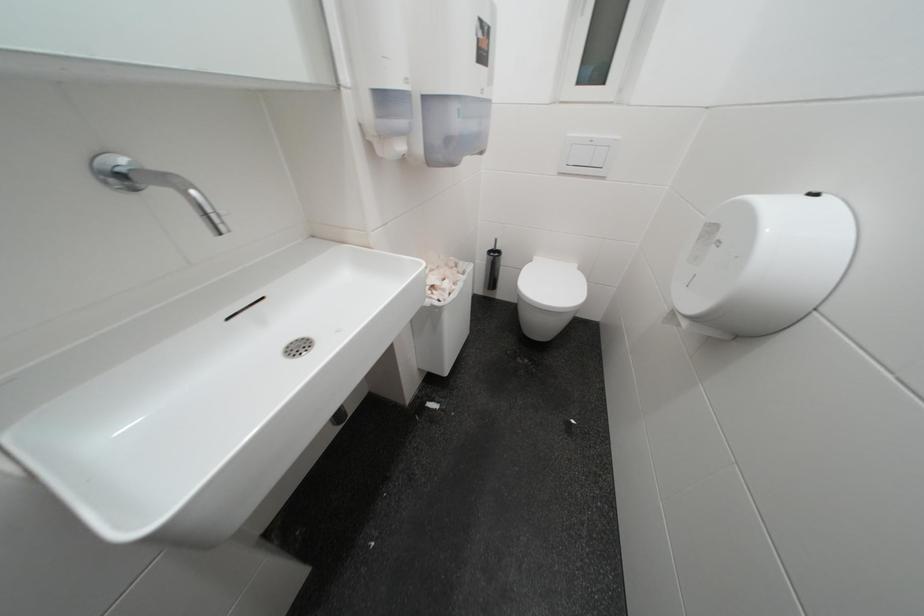
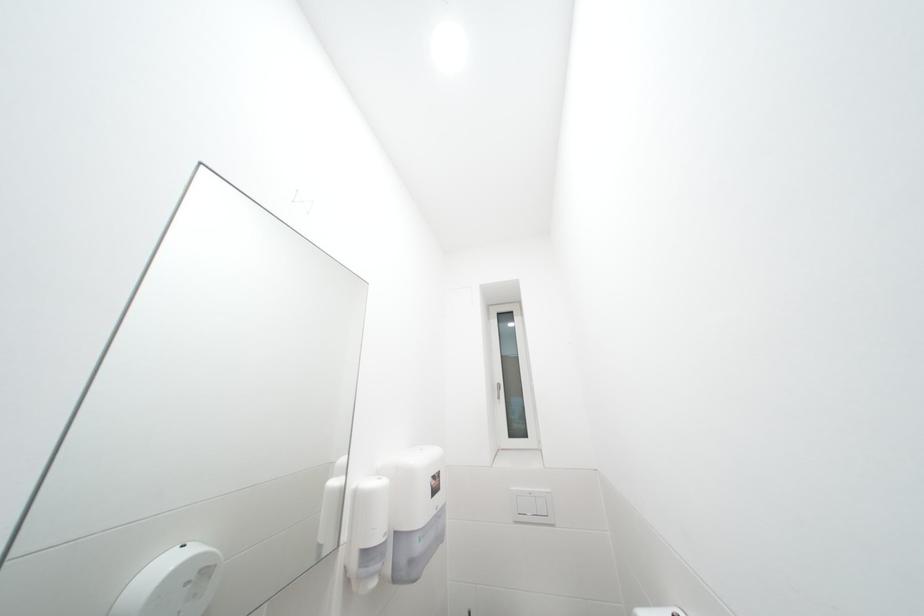
Question: The first image is from the beginning of the video and the second image is from the end. How did the camera likely rotate when shooting the video?

Choices:
 (A) Left
 (B) Right
 (C) Up
 (D) Down

Answer: (C)